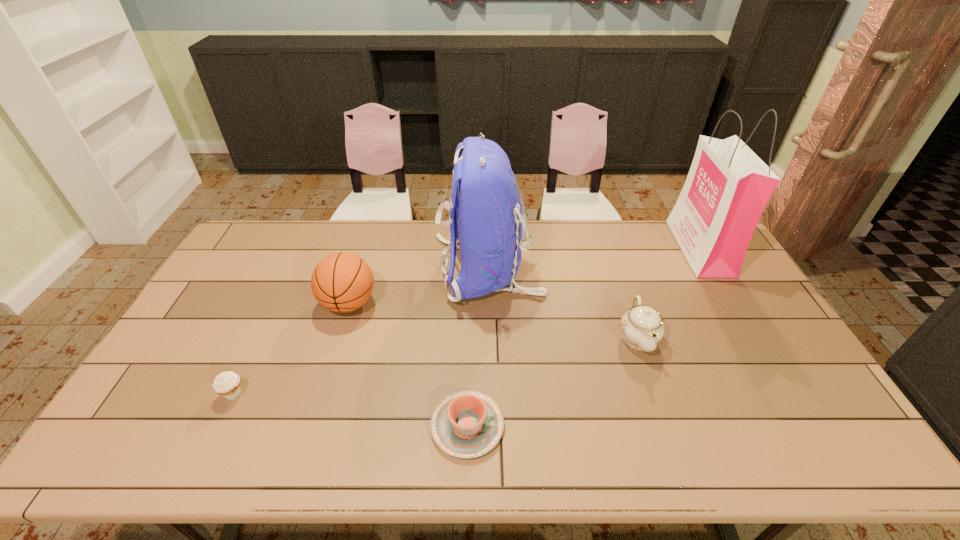
The image size is (960, 540). What are the coordinates of `free space located 0.260m on the front-facing side of the rightmost object` in the screenshot? It's located at (609, 248).

You are a GUI agent. You are given a task and a screenshot of the screen. Output one action in this format:
    pyautogui.click(x=<x>, y=<y>)
    Task: Click on the vacant area situated on the front-facing side of the rightmost object
    
    Given the screenshot: What is the action you would take?
    pyautogui.click(x=592, y=248)

Where is `vacant space located 0.370m on the front-facing side of the rightmost object`? This screenshot has height=540, width=960. vacant space located 0.370m on the front-facing side of the rightmost object is located at coordinates click(578, 248).

Where is `vacant area located on the back of the backpack`? Image resolution: width=960 pixels, height=540 pixels. vacant area located on the back of the backpack is located at coordinates coord(409,268).

Locate an element on the screen. This screenshot has height=540, width=960. free region located on the back of the backpack is located at coordinates (383, 268).

Locate an element on the screen. vacant space located 0.290m on the back of the backpack is located at coordinates (348, 268).

Identify the location of vacant space situated on the back of the fifth object from right to left. This screenshot has width=960, height=540. (364, 255).

Identify the location of free region located at the spout of the fifth object from left to right. This screenshot has height=540, width=960. (663, 414).

Locate an element on the screen. This screenshot has height=540, width=960. free space located 0.400m on the back of the leftmost object is located at coordinates (287, 282).

This screenshot has width=960, height=540. I want to click on vacant space positioned 0.230m on the handle side of the shortest object, so (597, 426).